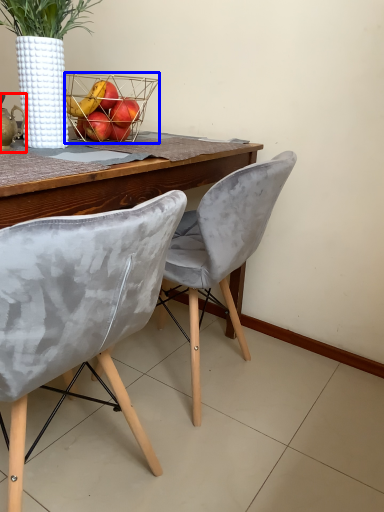
Question: Among these objects, which one is nearest to the camera, tea pot (highlighted by a red box) or basket (highlighted by a blue box)?

Choices:
 (A) tea pot
 (B) basket

Answer: (A)